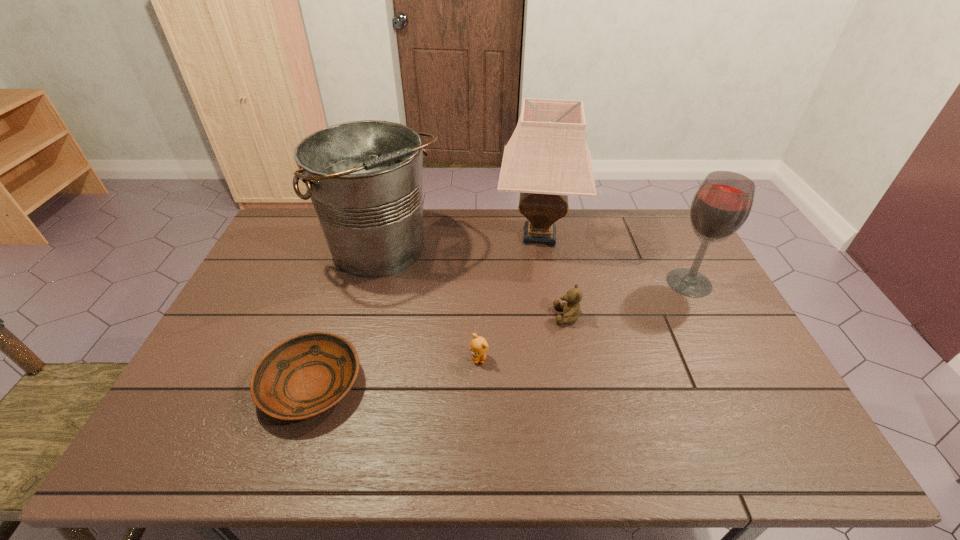
Identify the location of lampshade. This screenshot has width=960, height=540. (547, 158).

At what (x,y) coordinates should I click in order to perform the action: click on bucket. Please return your answer as a coordinate pair (x, y). Looking at the image, I should click on (364, 178).

You are a GUI agent. You are given a task and a screenshot of the screen. Output one action in this format:
    pyautogui.click(x=<x>, y=<y>)
    Task: Click on the rightmost object
    The height and width of the screenshot is (540, 960).
    Given the screenshot: What is the action you would take?
    pyautogui.click(x=721, y=205)

At what (x,y) coordinates should I click in order to perform the action: click on the fourth tallest object. Please return your answer as a coordinate pair (x, y). This screenshot has width=960, height=540. Looking at the image, I should click on (571, 309).

Identify the location of the taller teddy bear. The image size is (960, 540). (571, 309).

The height and width of the screenshot is (540, 960). I want to click on the left teddy bear, so click(x=478, y=346).

I want to click on the fourth object from right to left, so click(x=478, y=346).

Find the location of a particular element. The height and width of the screenshot is (540, 960). plate is located at coordinates (304, 376).

Locate an element on the screen. The width and height of the screenshot is (960, 540). free region located on the left of the lampshade is located at coordinates (428, 236).

Where is `vacant position located 0.120m on the front of the bucket`? vacant position located 0.120m on the front of the bucket is located at coordinates (366, 321).